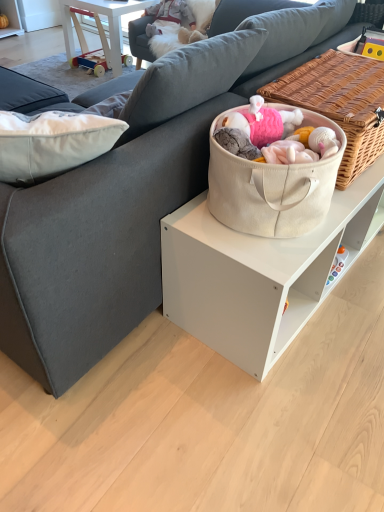
Image resolution: width=384 pixels, height=512 pixels. I want to click on wooden toy at upper left, so click(x=99, y=26).

What do you see at coordinates (99, 26) in the screenshot? I see `wooden toy at upper left` at bounding box center [99, 26].

The width and height of the screenshot is (384, 512). What do you see at coordinates (339, 103) in the screenshot?
I see `beige canvas tote at center` at bounding box center [339, 103].

In order to face beige canvas tote at center, should I rotate leftwards or rightwards?

You should rotate right by 19.319 degrees.

What is the approximate width of beige canvas tote at center?

The width of beige canvas tote at center is 16.41 inches.

This screenshot has width=384, height=512. In order to click on beige canvas tote at center in this screenshot , I will do `click(339, 103)`.

Locate an element on the screen. wooden toy at upper left is located at coordinates (99, 26).

Is beige canvas tote at center at the right side of wooden toy at upper left?

Indeed, beige canvas tote at center is positioned on the right side of wooden toy at upper left.

Between beige canvas tote at center and wooden toy at upper left, which one is positioned in front?

beige canvas tote at center.

Is point (382, 96) in front of point (117, 55)?

Yes, it is in front of point (117, 55).

From the image's perspective, is beige canvas tote at center under wooden toy at upper left?

Indeed, from the image's perspective, beige canvas tote at center is shown beneath wooden toy at upper left.

From a real-world perspective, which is physically above, beige canvas tote at center or wooden toy at upper left?

beige canvas tote at center.

Between beige canvas tote at center and wooden toy at upper left, which one has smaller width?

beige canvas tote at center.

Is beige canvas tote at center taller than wooden toy at upper left?

Incorrect, the height of beige canvas tote at center is not larger of that of wooden toy at upper left.

Considering the relative sizes of beige canvas tote at center and wooden toy at upper left in the image provided, is beige canvas tote at center smaller than wooden toy at upper left?

Yes, beige canvas tote at center is smaller than wooden toy at upper left.

Is wooden toy at upper left a part of beige canvas tote at center?

No, wooden toy at upper left is not surrounded by beige canvas tote at center.

Is beige canvas tote at center positioned far away from wooden toy at upper left?

beige canvas tote at center is positioned a significant distance from wooden toy at upper left.

Is wooden toy at upper left at the back of beige canvas tote at center?

Absolutely, beige canvas tote at center is directed away from wooden toy at upper left.

Where is `table beneath the beige canvas tote at center (from a real-world perspective)`? Image resolution: width=384 pixels, height=512 pixels. table beneath the beige canvas tote at center (from a real-world perspective) is located at coordinates (99, 26).

Would you say wooden toy at upper left is to the left or to the right of beige canvas tote at center in the picture?

From the image, it's evident that wooden toy at upper left is to the left of beige canvas tote at center.

Looking at this image, which is behind, wooden toy at upper left or beige canvas tote at center?

wooden toy at upper left is further from the camera.

Which is less distant, [103,13] or [311,101]?

The point [311,101] is in front.

From the image's perspective, is wooden toy at upper left located beneath beige canvas tote at center?

No, from the image's perspective, wooden toy at upper left is not beneath beige canvas tote at center.

From a real-world perspective, is wooden toy at upper left positioned under beige canvas tote at center based on gravity?

Yes, from a real-world perspective, wooden toy at upper left is beneath beige canvas tote at center.

Consider the image. Which object is wider, wooden toy at upper left or beige canvas tote at center?

wooden toy at upper left is wider.

Which of these two, wooden toy at upper left or beige canvas tote at center, stands taller?

wooden toy at upper left.

Which of these two, wooden toy at upper left or beige canvas tote at center, is bigger?

With larger size is wooden toy at upper left.

Is wooden toy at upper left situated inside beige canvas tote at center or outside?

wooden toy at upper left is spatially situated outside beige canvas tote at center.

Is the surface of wooden toy at upper left in direct contact with beige canvas tote at center?

No, wooden toy at upper left is not in contact with beige canvas tote at center.

Is wooden toy at upper left positioned with its back to beige canvas tote at center?

No, beige canvas tote at center is not at the back of wooden toy at upper left.

Measure the distance between wooden toy at upper left and beige canvas tote at center.

wooden toy at upper left and beige canvas tote at center are 6.62 feet apart from each other.

The width and height of the screenshot is (384, 512). In order to click on picnic basket in front of the wooden toy at upper left in this screenshot , I will do `click(339, 103)`.

The width and height of the screenshot is (384, 512). I want to click on table on the left of beige canvas tote at center, so click(x=99, y=26).

Find the location of `picnic basket in front of the wooden toy at upper left`. picnic basket in front of the wooden toy at upper left is located at coordinates (339, 103).